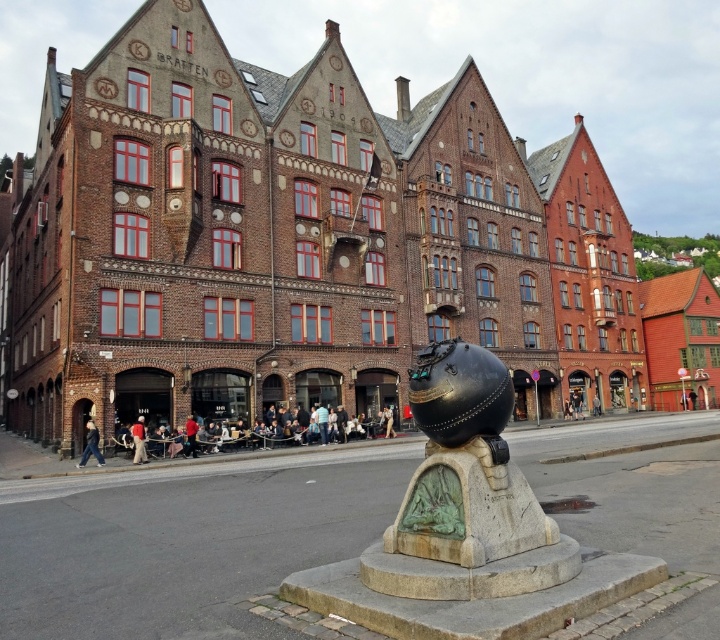
Who is positioned more to the right, dark blue jeans at center or red shirt at lower left?

dark blue jeans at center

Who is taller, dark blue jeans at center or red shirt at lower left?

dark blue jeans at center

Measure the distance between dark blue jeans at center and camera.

dark blue jeans at center is 154.03 feet from camera.

Locate an element on the screen. dark blue jeans at center is located at coordinates (266, 445).

Can you confirm if dark blue jeans at lower left is positioned above red shirt at lower left?

Actually, dark blue jeans at lower left is below red shirt at lower left.

Does point (94, 451) lie behind point (143, 442)?

No, it is in front of (143, 442).

The width and height of the screenshot is (720, 640). What do you see at coordinates (90, 445) in the screenshot?
I see `dark blue jeans at lower left` at bounding box center [90, 445].

Where is `dark blue jeans at lower left`? dark blue jeans at lower left is located at coordinates (90, 445).

Which is in front, point (441, 406) or point (199, 444)?

Point (441, 406) is in front.

Is shiny black sphere at center taller than dark blue jeans at center?

Indeed, shiny black sphere at center has a greater height compared to dark blue jeans at center.

Who is more forward, (451, 579) or (252, 456)?

Point (451, 579)

At what (x,y) coordinates should I click in order to perform the action: click on shiny black sphere at center. Please return your answer as a coordinate pair (x, y). Looking at the image, I should click on (467, 493).